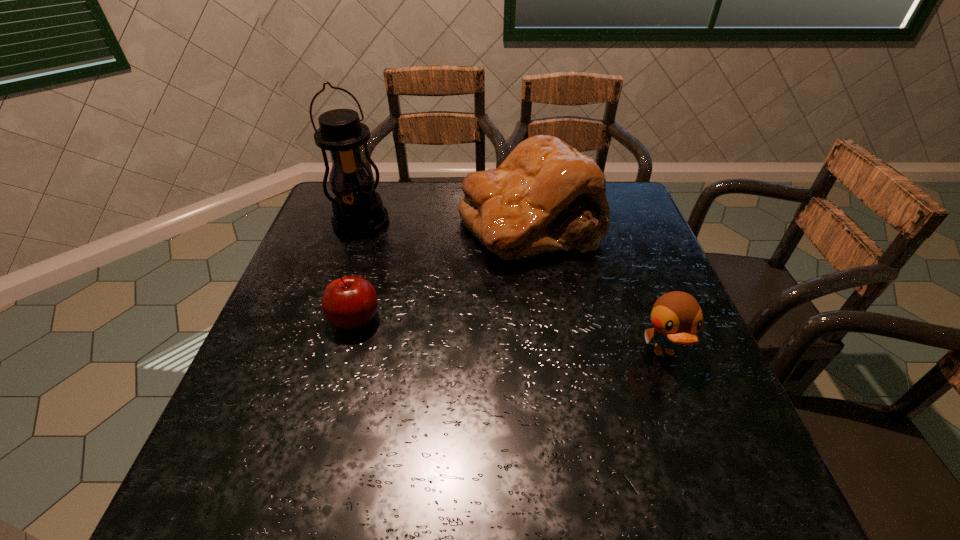
You are a GUI agent. You are given a task and a screenshot of the screen. Output one action in this format:
    pyautogui.click(x=<x>, y=<y>)
    Task: Click on the shortest object
    This screenshot has height=540, width=960.
    Given the screenshot: What is the action you would take?
    pyautogui.click(x=350, y=302)

At what (x,y) coordinates should I click in order to perform the action: click on the second shortest object. Please return your answer as a coordinate pair (x, y). The width and height of the screenshot is (960, 540). Looking at the image, I should click on (676, 316).

At what (x,y) coordinates should I click in order to perform the action: click on the tallest object. Please return your answer as a coordinate pair (x, y). Image resolution: width=960 pixels, height=540 pixels. Looking at the image, I should click on (358, 211).

Where is `bread`? The width and height of the screenshot is (960, 540). bread is located at coordinates (546, 196).

Identify the location of vacant space situated on the back of the apple. This screenshot has width=960, height=540. (385, 211).

Locate an element on the screen. vacant space located on the front-facing side of the duck is located at coordinates (690, 422).

Locate several points within vacant space situated above the tallest object, indicating its light source. Please provide its 2D coordinates. Your answer should be formatted as a tuple, i.e. [(x, y)], where the tuple contains the x and y coordinates of a point satisfying the conditions above.

[(394, 258)]

Find several locations within the vacant space located above the tallest object, indicating its light source. Please provide its 2D coordinates. Your answer should be formatted as a tuple, i.e. [(x, y)], where the tuple contains the x and y coordinates of a point satisfying the conditions above.

[(415, 282)]

Give me the position of a free location located 0.230m above the tallest object, indicating its light source. Please provide its 2D coordinates. Your answer should be formatted as a tuple, i.e. [(x, y)], where the tuple contains the x and y coordinates of a point satisfying the conditions above.

[(415, 282)]

Find the location of a particular element. free space located 0.120m on the filling side of the bread is located at coordinates (506, 303).